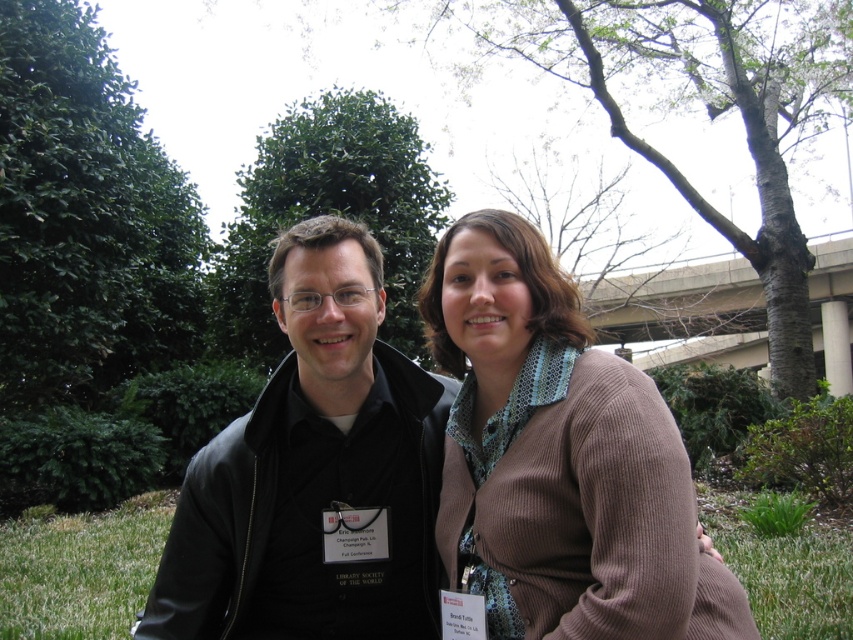
Question: Which object appears closest to the camera in this image?

Choices:
 (A) green leafy tree at center
 (B) green leafy tree at upper left
 (C) brown corduroy sweater at center

Answer: (C)

Question: Can you confirm if brown corduroy sweater at center is positioned above green leafy tree at center?

Choices:
 (A) no
 (B) yes

Answer: (A)

Question: Which of the following is the closest to the observer?

Choices:
 (A) (444, 356)
 (B) (112, 532)
 (C) (316, 145)
 (D) (77, 120)

Answer: (A)

Question: Which object is closer to the camera taking this photo?

Choices:
 (A) black leather jacket at center
 (B) green leafy tree at center
 (C) green leafy tree at upper left

Answer: (A)

Question: Is black leather jacket at center closer to camera compared to green leafy tree at center?

Choices:
 (A) no
 (B) yes

Answer: (B)

Question: Is green leafy tree at upper left further to camera compared to green leafy tree at center?

Choices:
 (A) yes
 (B) no

Answer: (B)